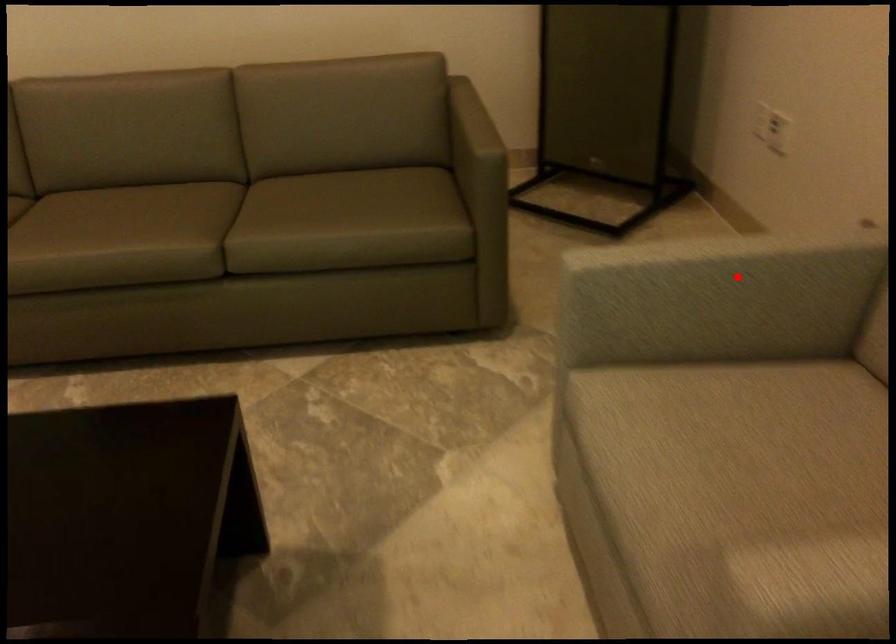
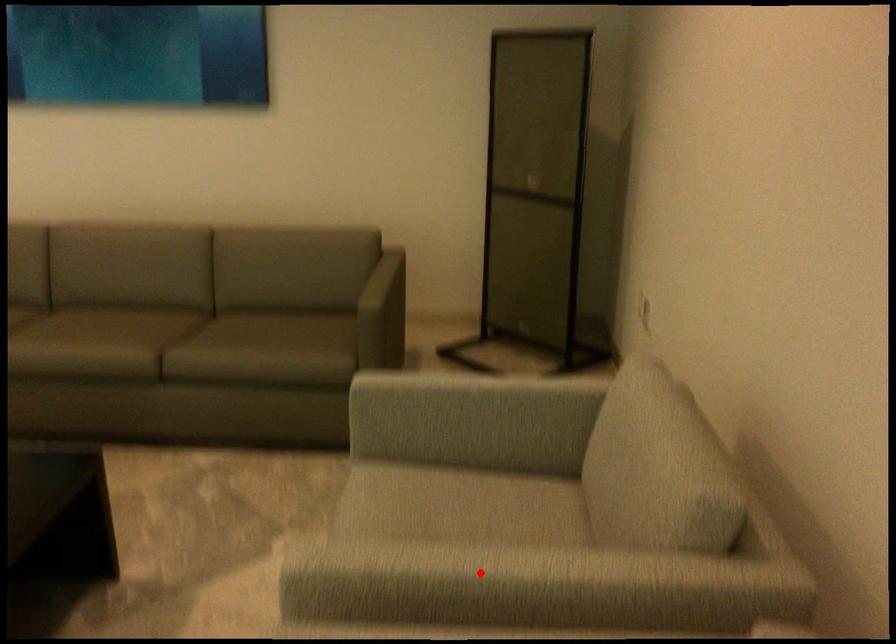
I am providing you with two images of the same scene from different viewpoints. A red point is marked on the first image and another point is marked on the second image. Does the point marked in image1 correspond to the same location as the one in image2?

No